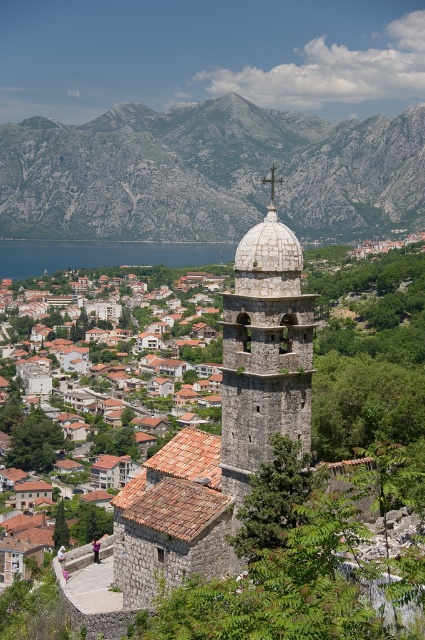
Which is more to the left, stone dome at center or terracotta tiled roofs at center?

From the viewer's perspective, terracotta tiled roofs at center appears more on the left side.

Which is behind, point (254, 346) or point (135, 577)?

The point (135, 577) is more distant.

Between point (235, 428) and point (176, 449), which one is positioned behind?

The point (176, 449) is more distant.

Identify the location of stone dome at center. (265, 353).

Which is more to the left, terracotta tiled roofs at center or blue water at lower left?

From the viewer's perspective, blue water at lower left appears more on the left side.

Who is more distant from viewer, (204,576) or (190,244)?

The point (190,244) is behind.

Is point (121, 529) positioned in front of point (135, 259)?

Yes, it is in front of point (135, 259).

You are a GUI agent. You are given a task and a screenshot of the screen. Output one action in this format:
    pyautogui.click(x=<x>, y=<y>)
    Task: Click on the terracotta tiled roofs at center
    
    Given the screenshot: What is the action you would take?
    pyautogui.click(x=173, y=515)

Is stone dome at center above white stone dome at center?

Actually, stone dome at center is below white stone dome at center.

Between point (234, 316) and point (249, 250), which one is positioned in front?

Point (249, 250) is more forward.

Identify the location of stone dome at center. The height and width of the screenshot is (640, 425). (265, 353).